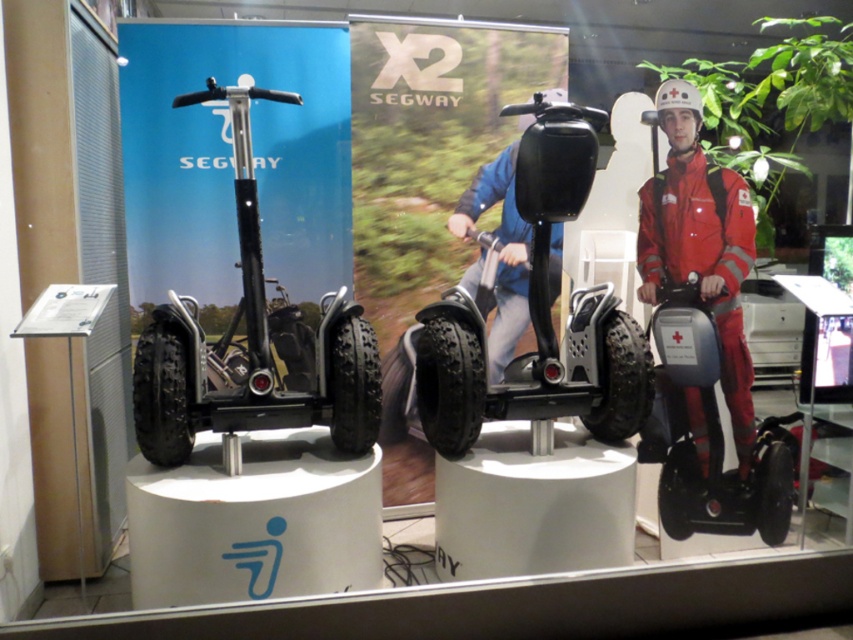
The image size is (853, 640). What do you see at coordinates (700, 243) in the screenshot? I see `red matte segway at right` at bounding box center [700, 243].

Is red matte segway at right taller than matte black scooter at right?

Yes, red matte segway at right is taller than matte black scooter at right.

Where is `red matte segway at right`? The height and width of the screenshot is (640, 853). red matte segway at right is located at coordinates (700, 243).

Who is positioned more to the left, black matte segway at left or matte black scooter at right?

Positioned to the left is black matte segway at left.

Between point (138, 444) and point (782, 540), which one is positioned in front?

Point (138, 444)

Is point (368, 372) behind point (660, 458)?

No, (368, 372) is in front of (660, 458).

The image size is (853, 640). In order to click on black matte segway at left in this screenshot , I will do `click(252, 346)`.

Which is above, black matte segway at left or black rubber segway at center?

Positioned higher is black matte segway at left.

Does black matte segway at left appear on the right side of black rubber segway at center?

In fact, black matte segway at left is to the left of black rubber segway at center.

Is point (148, 323) behind point (618, 394)?

Yes, point (148, 323) is farther from viewer.

Image resolution: width=853 pixels, height=640 pixels. I want to click on black matte segway at left, so click(x=252, y=346).